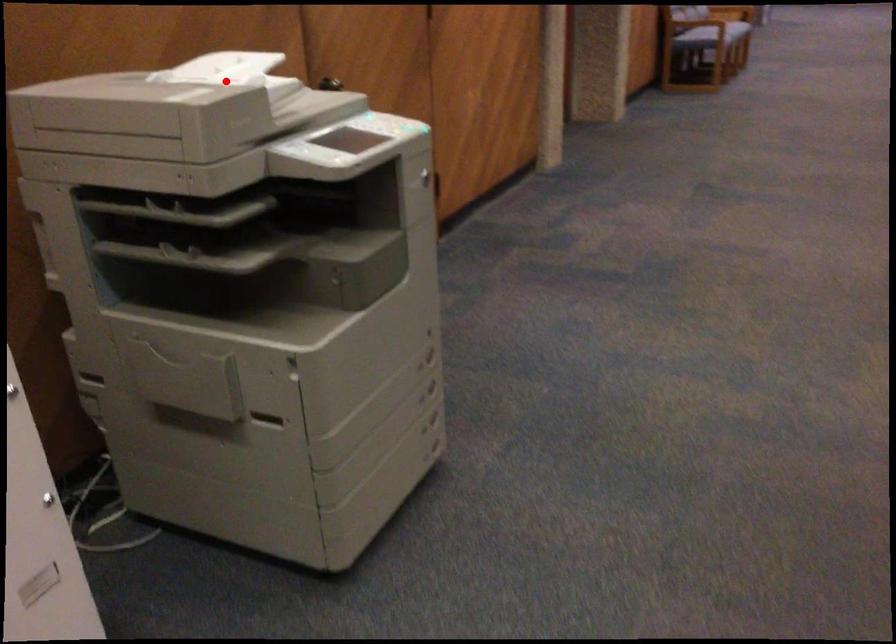
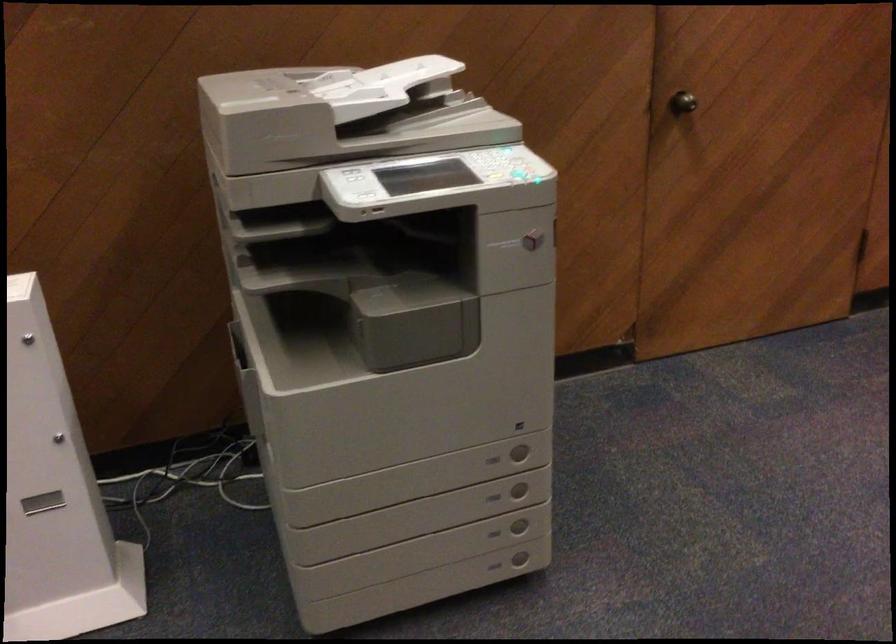
Find the pixel in the second image that matches the highlighted location in the first image.

(437, 86)